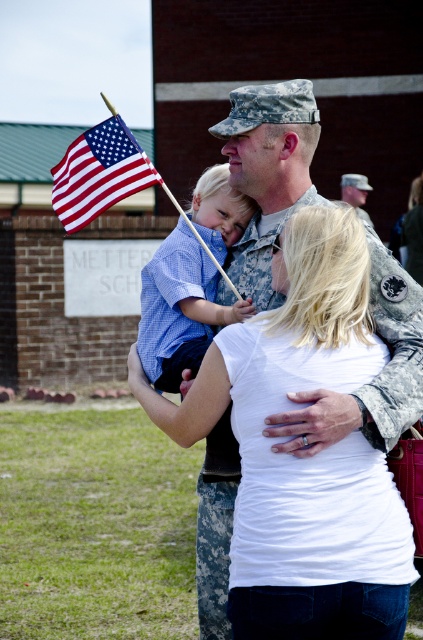
Question: Which object is positioned closest to the white matte shirt at center?

Choices:
 (A) camouflage uniform at center
 (B) polyester american flag at upper left

Answer: (B)

Question: Is the position of white matte shirt at center less distant than that of checkered shirt at center?

Choices:
 (A) yes
 (B) no

Answer: (A)

Question: Estimate the real-world distances between objects in this image. Which object is closer to the white matte shirt at center?

Choices:
 (A) polyester american flag at upper left
 (B) camouflage uniform at center

Answer: (A)

Question: Is checkered shirt at center in front of polyester american flag at upper left?

Choices:
 (A) no
 (B) yes

Answer: (A)

Question: Among these points, which one is nearest to the camera?

Choices:
 (A) (272, 609)
 (B) (186, 308)
 (C) (345, 176)

Answer: (A)

Question: Does checkered shirt at center have a larger size compared to polyester american flag at upper left?

Choices:
 (A) yes
 (B) no

Answer: (A)